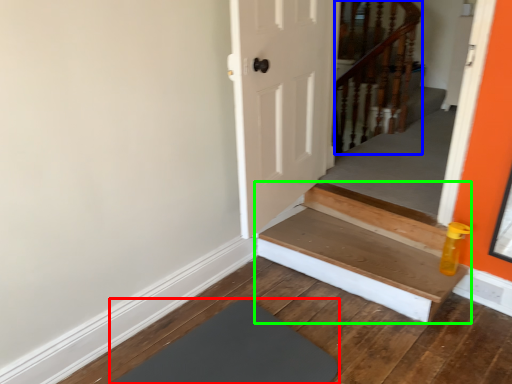
Question: Based on their relative distances, which object is farther from mat (highlighted by a red box)? Choose from rail (highlighted by a blue box) and stairs (highlighted by a green box).

Choices:
 (A) rail
 (B) stairs

Answer: (A)